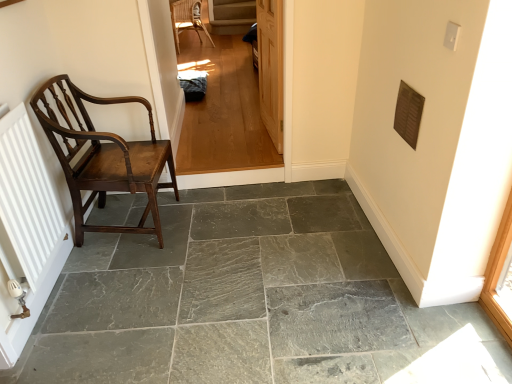
Question: Visually, is wooden door at center positioned to the left or to the right of polished wood chair at left, the first chair when ordered from front to back?

Choices:
 (A) right
 (B) left

Answer: (A)

Question: From a real-world perspective, relative to polished wood chair at left, the first chair when ordered from front to back, is wooden door at center vertically above or below?

Choices:
 (A) below
 (B) above

Answer: (B)

Question: Which is nearer to the polished wood chair at left, the first chair when ordered from front to back?

Choices:
 (A) gray stone floor at center
 (B) wooden door at center
 (C) woven wicker chair at upper center, which ranks as the 2th chair in bottom-to-top order
 (D) light brown wood floor at center

Answer: (A)

Question: Which is farther from the gray stone floor at center?

Choices:
 (A) polished wood chair at left, acting as the 2th chair starting from the back
 (B) woven wicker chair at upper center, which appears as the 1th chair when viewed from the back
 (C) wooden door at center
 (D) light brown wood floor at center

Answer: (B)